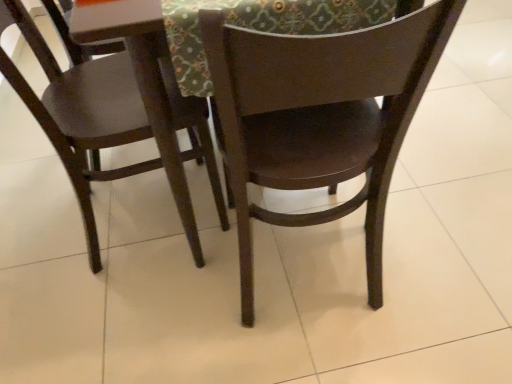
Find the location of a particular element. free space in front of dark wood chair at center, the first chair viewed from the right is located at coordinates (328, 352).